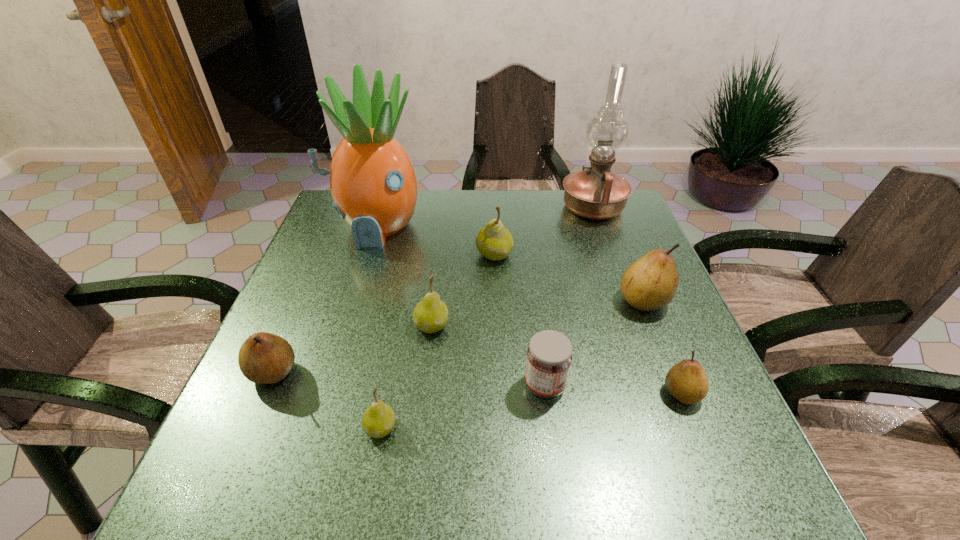
You are a GUI agent. You are given a task and a screenshot of the screen. Output one action in this format:
    pyautogui.click(x=<x>, y=<y>)
    Task: Click on the smallest brown pear
    
    Given the screenshot: What is the action you would take?
    pyautogui.click(x=686, y=381)

Find the location of `the nearest green pear`. the nearest green pear is located at coordinates (378, 420).

Identify the location of the nearest object. (378, 420).

In order to click on free space located on the left of the oil lamp in this screenshot , I will do `click(534, 208)`.

Find the location of a particular element. free space located at the entrance of the orange pineapple is located at coordinates (349, 309).

The width and height of the screenshot is (960, 540). Find the location of `vacant area situated on the back of the farthest brown pear`. vacant area situated on the back of the farthest brown pear is located at coordinates (605, 204).

Find the location of a particular element. Image resolution: width=960 pixels, height=540 pixels. vacant space located 0.300m on the front of the rightmost green pear is located at coordinates (498, 359).

The image size is (960, 540). Identify the location of vacant space located 0.280m on the right of the second biggest green pear. (575, 326).

What are the coordinates of `vacant space located on the right of the leftmost pear` in the screenshot? It's located at (458, 372).

At what (x,y) coordinates should I click in order to perform the action: click on vacant space located on the left of the jam. Please return your answer as a coordinate pair (x, y). Looking at the image, I should click on (396, 385).